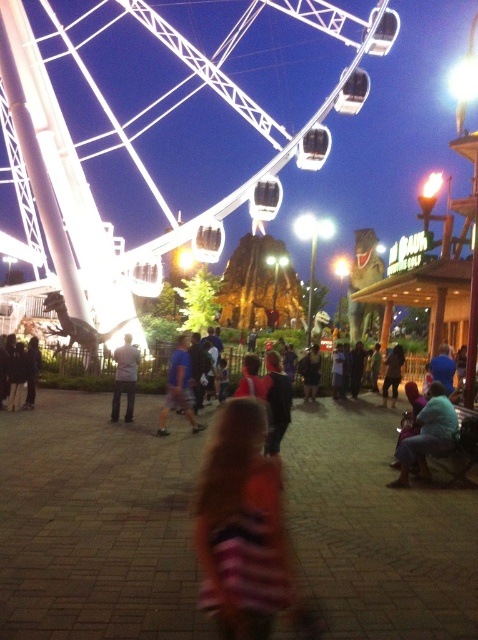
You are standing at the center of the paved area in front of the amusement park. Which direction should you look to see the white metallic ferris wheel at upper left?

The white metallic ferris wheel at upper left is located at point (248, 115), which means it is positioned to the upper left from your current position at the center. Therefore, you should look towards the upper left direction to see it.

You are at an amusement park and see a child wearing a striped fabric dress at center and another wearing blue denim jeans at lower right. Which child is positioned closer to the Ferris wheel?

The striped fabric dress at center is to the left of blue denim jeans at lower right. Since the Ferris wheel is on the left side of the frame, the child in the striped fabric dress at center is closer to the Ferris wheel.